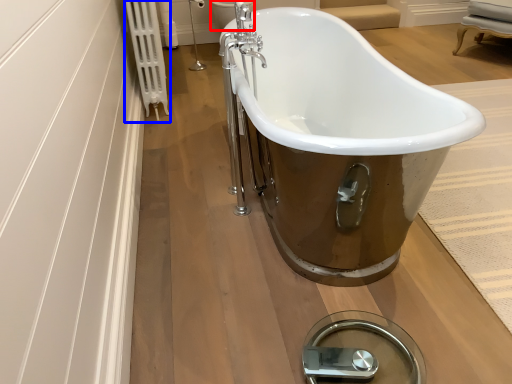
Question: Which object appears closest to the camera in this image, toilet bowl (highlighted by a red box) or radiator (highlighted by a blue box)?

Choices:
 (A) toilet bowl
 (B) radiator

Answer: (B)